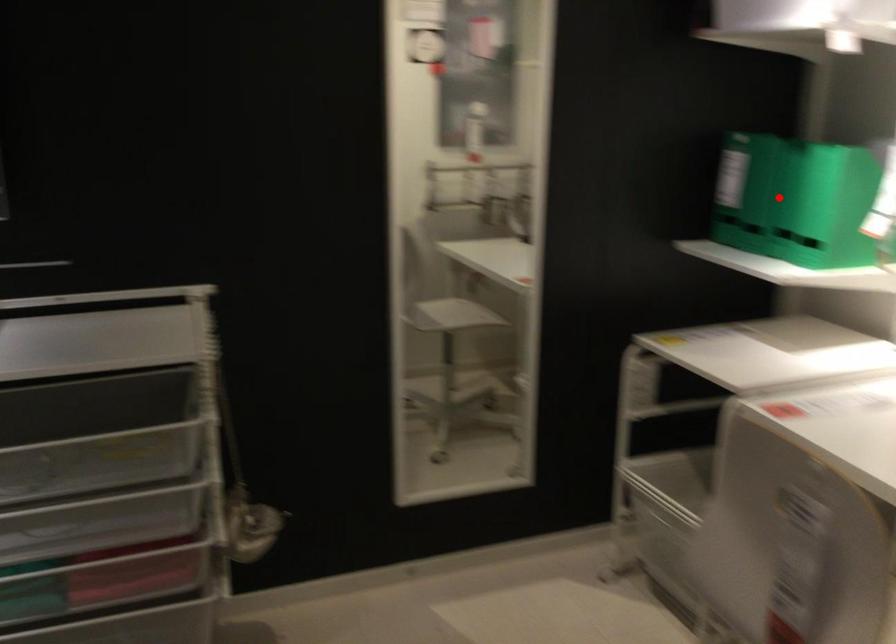
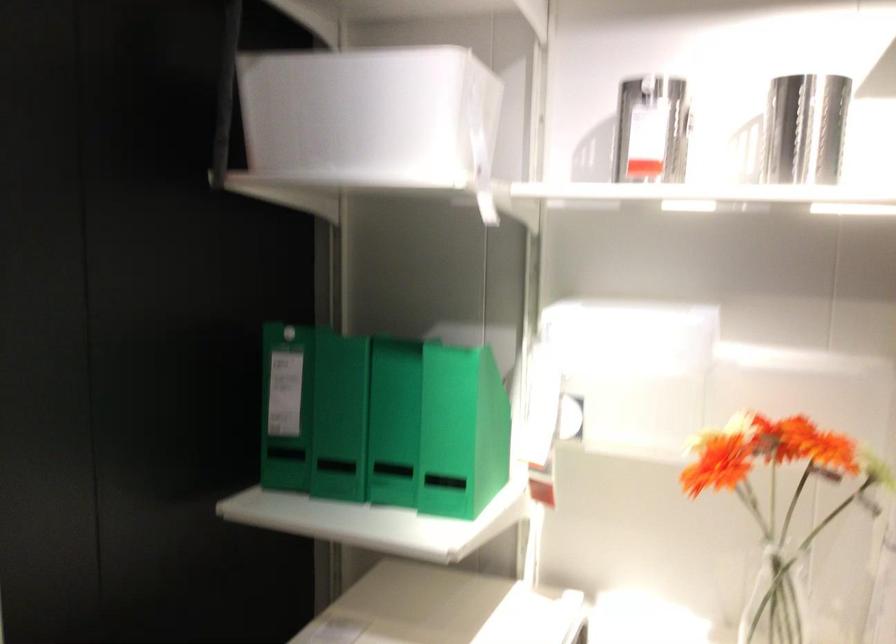
Locate, in the second image, the point that corresponds to the highlighted location in the first image.

(392, 422)